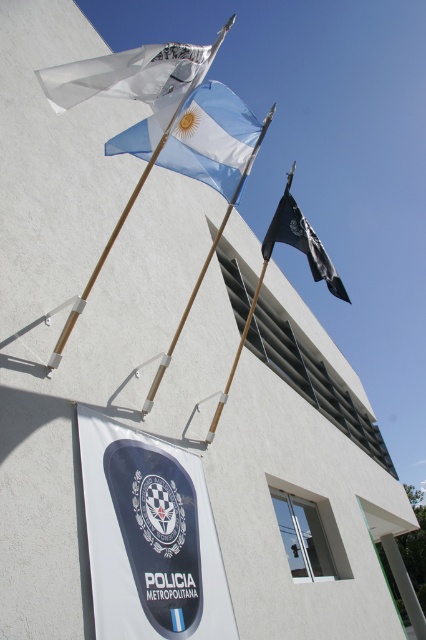
Between point (63, 99) and point (298, 244), which one is positioned in front?

Point (63, 99) is in front.

Can you confirm if white fabric flag at upper left is bigger than black matte flag at upper center?

Yes, white fabric flag at upper left is bigger than black matte flag at upper center.

At what (x,y) coordinates should I click in order to perform the action: click on white fabric flag at upper left. Please return your answer as a coordinate pair (x, y). The height and width of the screenshot is (640, 426). Looking at the image, I should click on (127, 74).

Does blue fabric flag at upper center appear over black matte flag at upper center?

Yes.

Is point (114, 144) less distant than point (345, 292)?

Yes, it is.

The image size is (426, 640). Identify the location of blue fabric flag at upper center. (212, 138).

Is black matte flag at upper center closer to the viewer compared to wooden pole at center?

That is False.

Is point (287, 225) in front of point (152, 394)?

That is False.

This screenshot has height=640, width=426. I want to click on black matte flag at upper center, so click(302, 243).